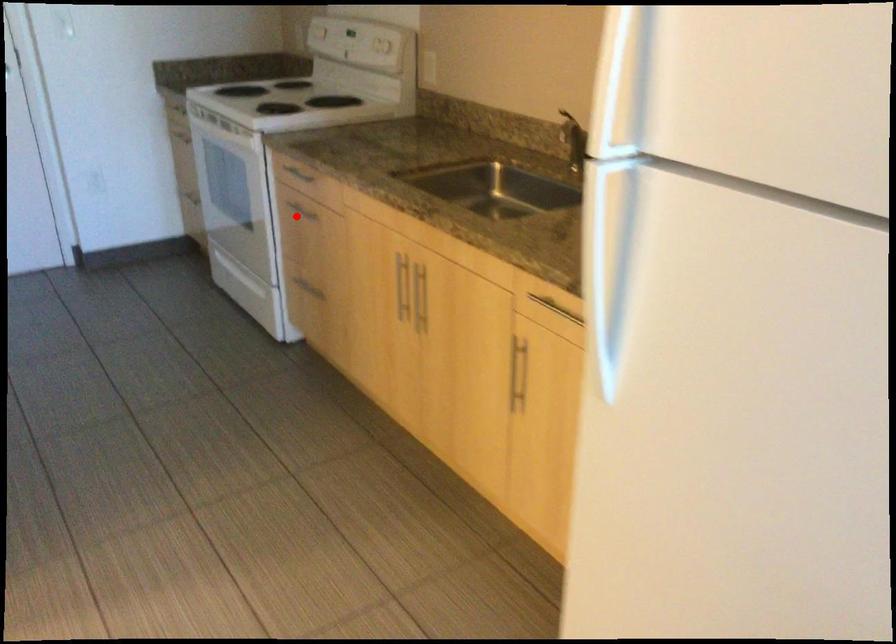
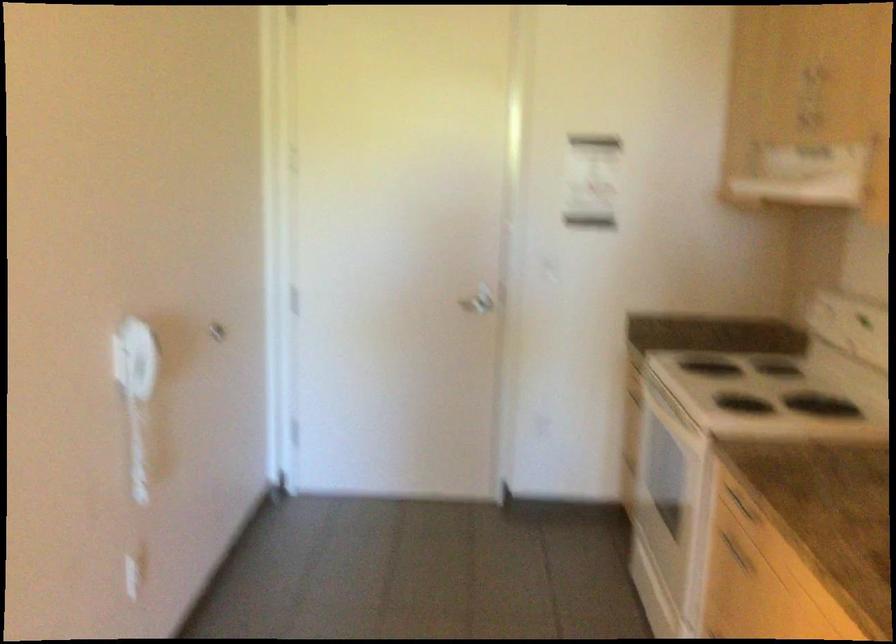
Locate, in the second image, the point that corresponds to the highlighted location in the first image.

(735, 552)